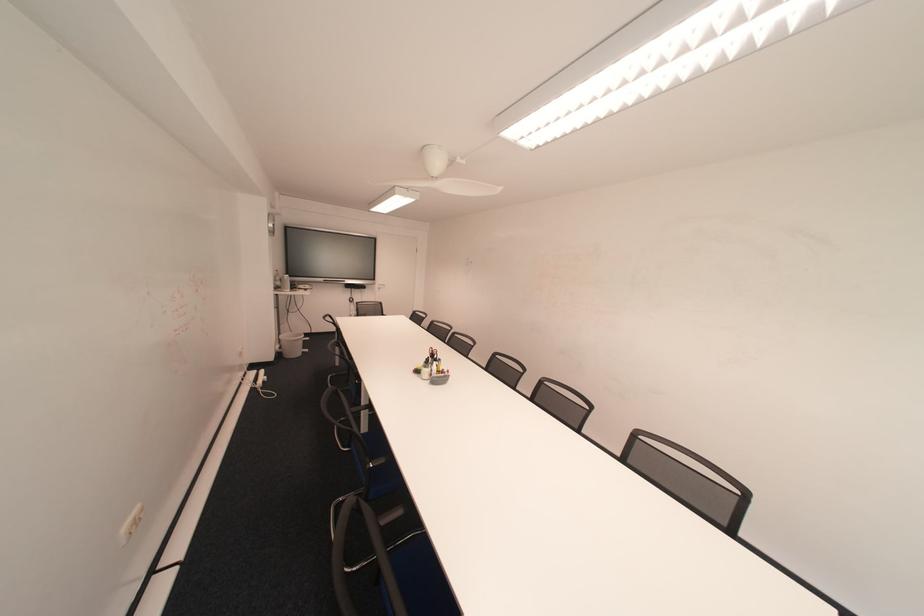
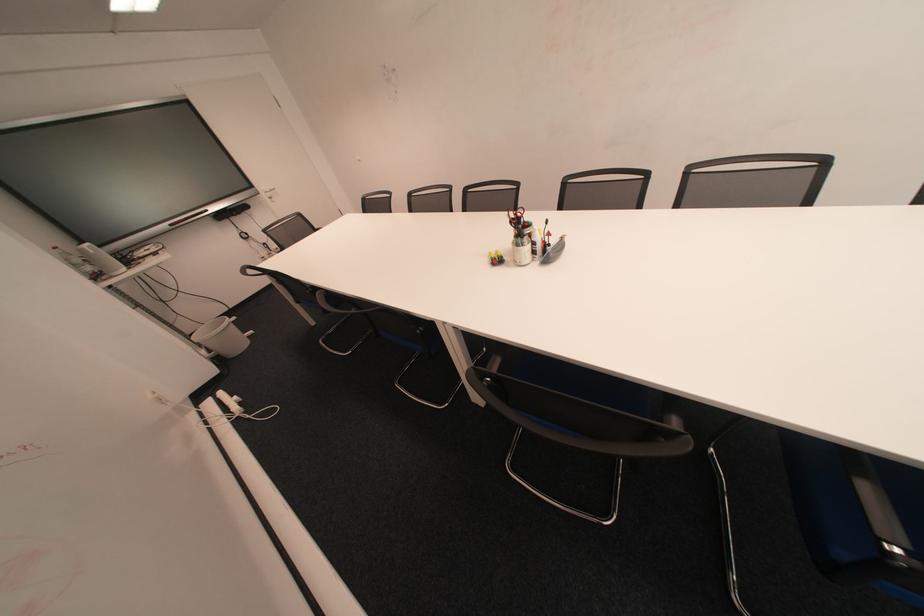
Where in the second image is the point corresponding to (290,341) from the first image?

(209, 345)